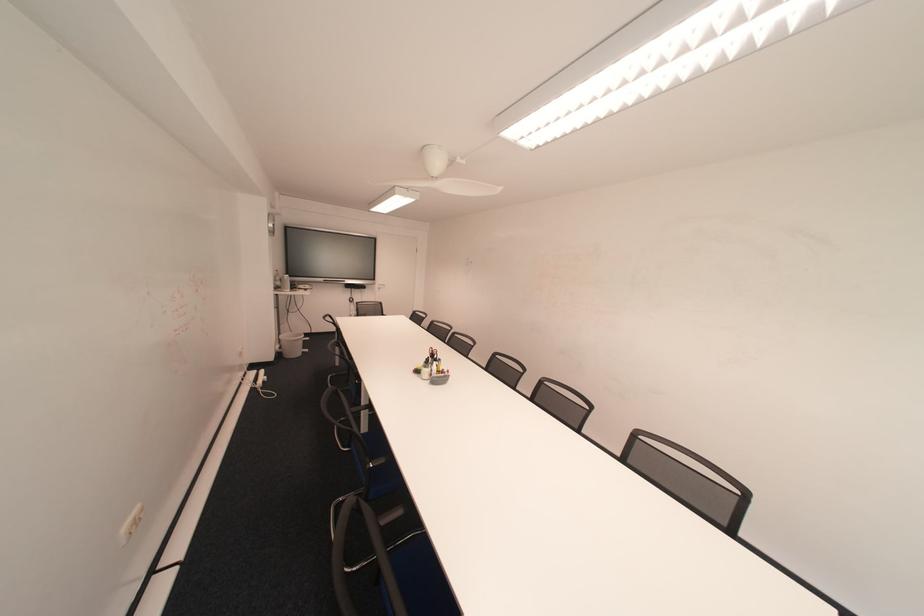
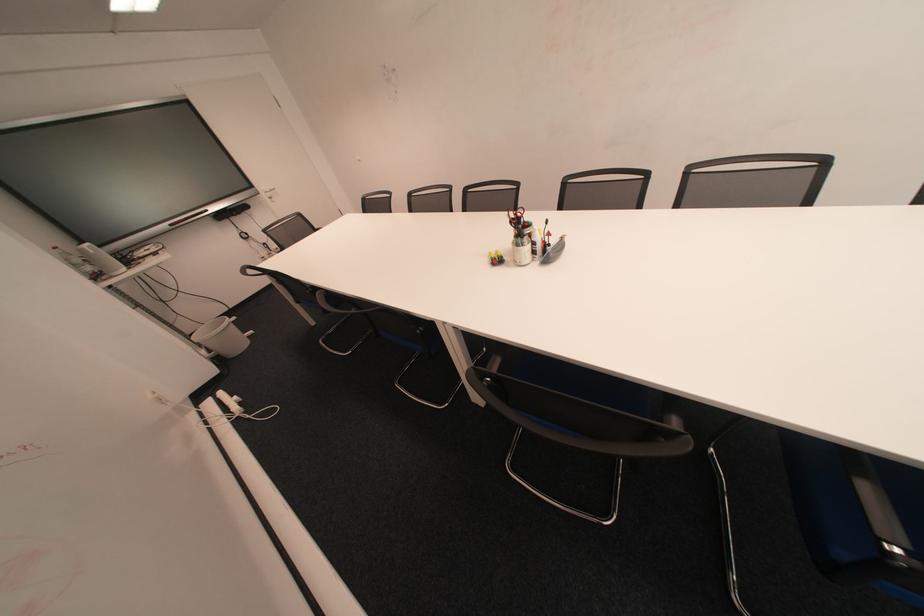
Where in the second image is the point corresponding to (290,341) from the first image?

(209, 345)